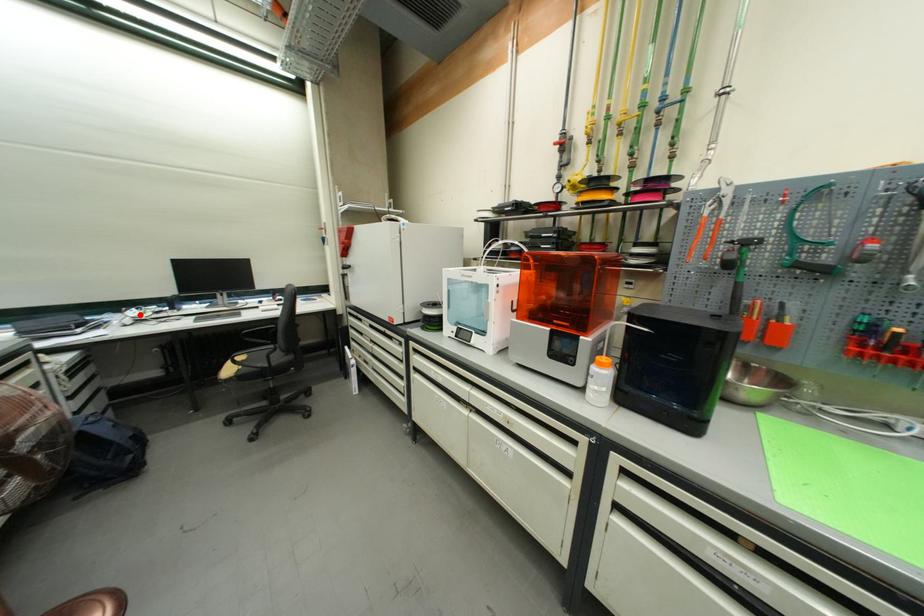
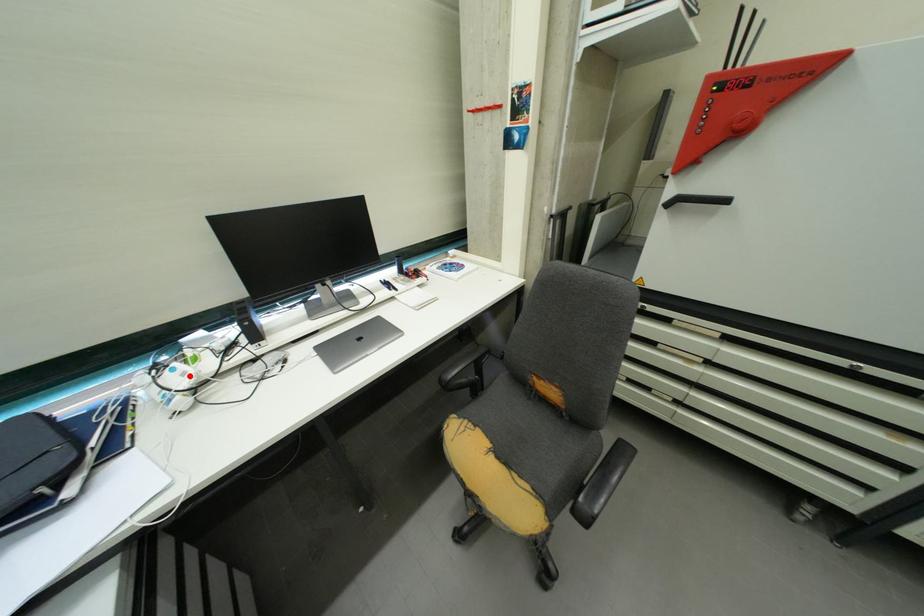
I am providing you with two images of the same scene from different viewpoints. A red point is marked on the first image and another point is marked on the second image. Do the highlighted points in image1 and image2 indicate the same real-world spot?

Yes